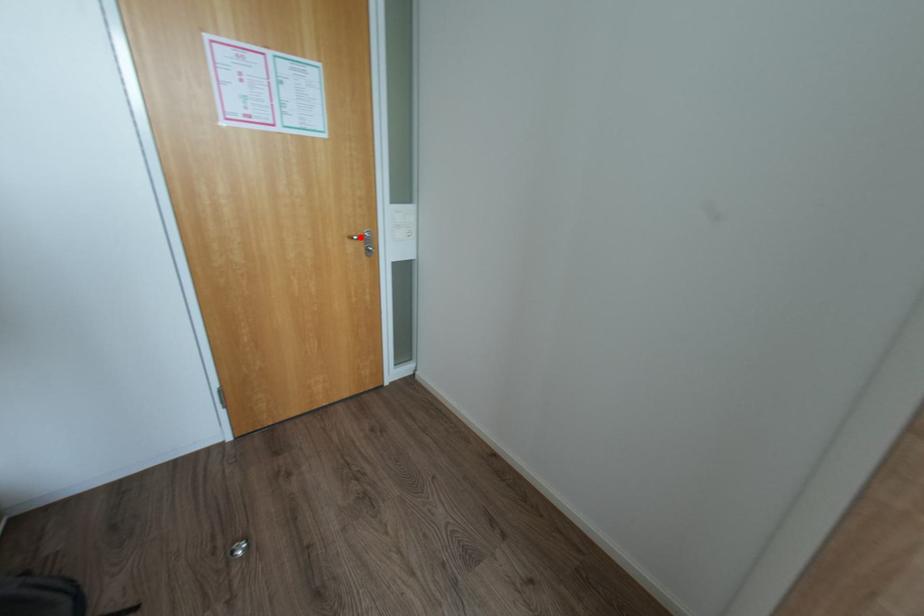
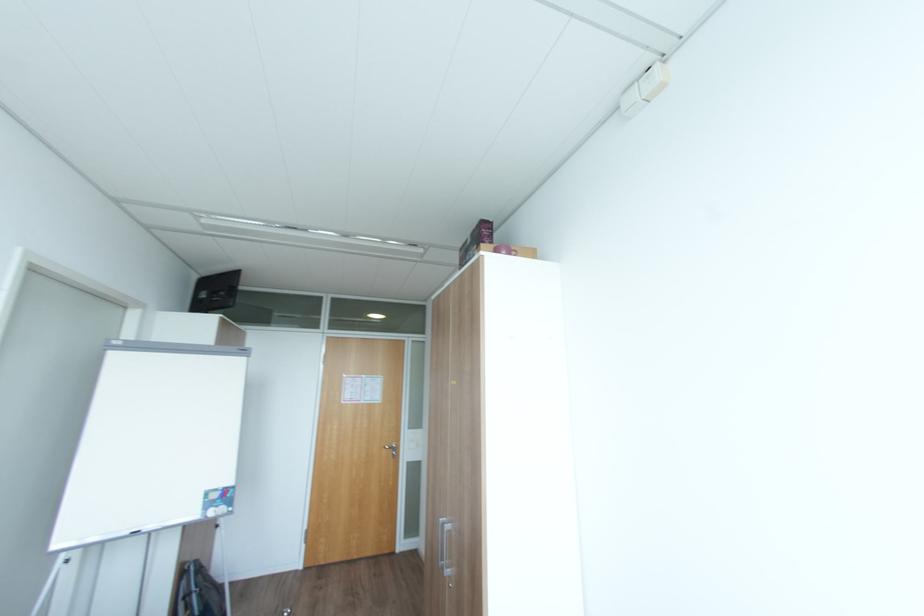
Where in the second image is the point corresponding to the highlighted location from the first image?

(392, 448)